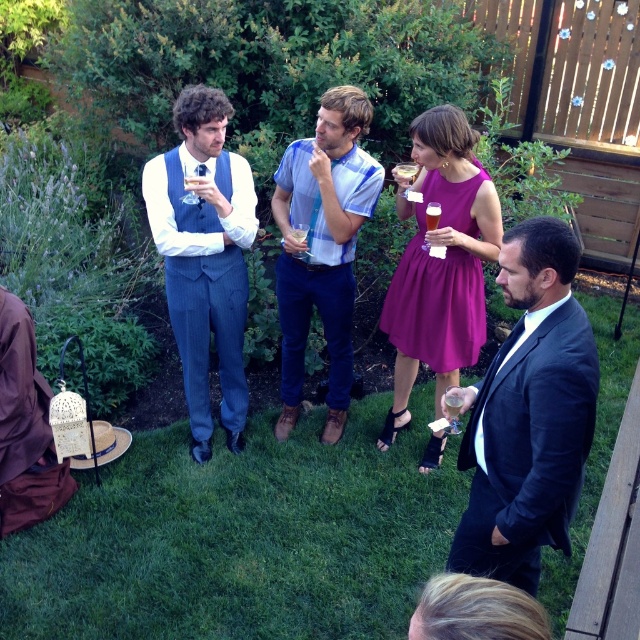
Question: Is pinstriped suit at center positioned in front of purple satin dress at center?

Choices:
 (A) no
 (B) yes

Answer: (A)

Question: Is blue striped shirt at center further to camera compared to purple satin dress at center?

Choices:
 (A) yes
 (B) no

Answer: (A)

Question: Which of the following is the closest to the observer?

Choices:
 (A) pinstriped suit at center
 (B) blue striped shirt at center
 (C) purple satin dress at center

Answer: (C)

Question: Which of the following is the farthest from the observer?

Choices:
 (A) dark suit at center
 (B) pinstriped suit at center
 (C) purple satin dress at center

Answer: (B)

Question: Among these objects, which one is nearest to the camera?

Choices:
 (A) pinstriped suit at center
 (B) blue striped shirt at center

Answer: (A)

Question: Is blue striped shirt at center to the left of purple satin dress at center from the viewer's perspective?

Choices:
 (A) yes
 (B) no

Answer: (A)